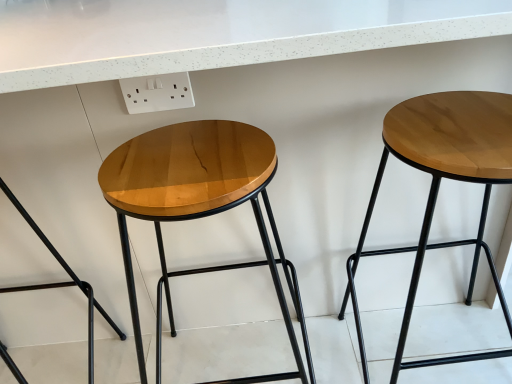
Where is `vacant space in front of white plastic outlet at upper center`? Image resolution: width=512 pixels, height=384 pixels. vacant space in front of white plastic outlet at upper center is located at coordinates (174, 149).